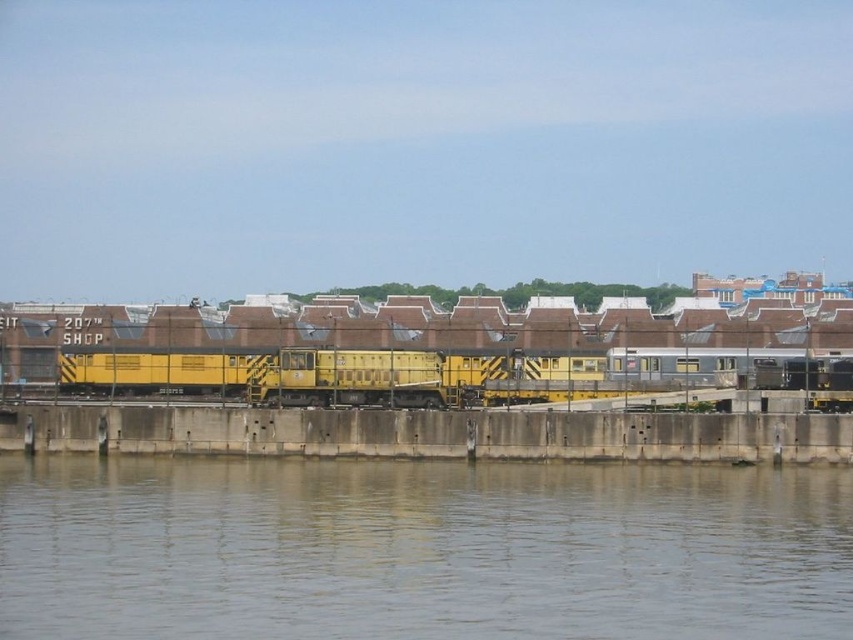
You are standing at the edge of the waterfront scene. You see the gray smooth water at lower center and the concrete at center. Which surface would you prefer to walk on if you want to avoid getting your shoes wet?

The concrete at center is behind the gray smooth water at lower center, so walking on the concrete at center would keep your shoes dry since it is not the water surface.

You are standing at the point with coordinates point (283, 368) and want to walk towards the point with coordinates point (259, 573). Which direction should you face to walk directly towards your destination?

You should face towards the direction of point (259, 573), which is in front of point (283, 368), so you need to walk forward towards it.